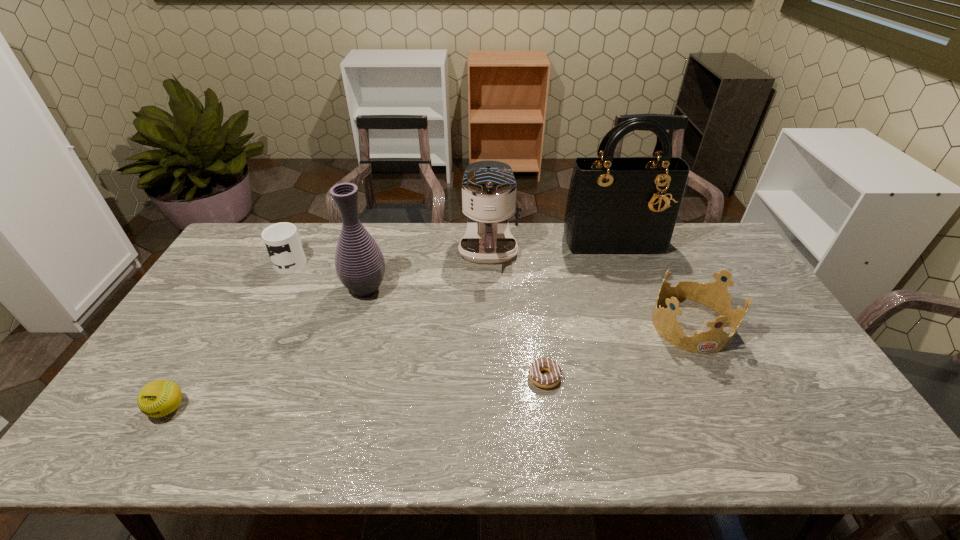
The height and width of the screenshot is (540, 960). I want to click on blank space at the near right corner of the desktop, so click(827, 443).

Image resolution: width=960 pixels, height=540 pixels. What are the coordinates of `blank region between the softball and the handbag` in the screenshot? It's located at pyautogui.click(x=391, y=325).

The width and height of the screenshot is (960, 540). Find the location of `vacant area that lies between the mug and the shortest object`. vacant area that lies between the mug and the shortest object is located at coordinates (419, 319).

You are a GUI agent. You are given a task and a screenshot of the screen. Output one action in this format:
    pyautogui.click(x=<x>, y=<y>)
    Task: Click on the vacant area that lies between the second shortest object and the handbag
    This screenshot has height=540, width=960.
    Given the screenshot: What is the action you would take?
    pyautogui.click(x=391, y=325)

You are a GUI agent. You are given a task and a screenshot of the screen. Output one action in this format:
    pyautogui.click(x=<x>, y=<y>)
    Task: Click on the vacant region between the third object from left to right and the coffee maker
    The image size is (960, 540).
    Given the screenshot: What is the action you would take?
    pyautogui.click(x=427, y=271)

Identify the location of unoccupied area between the third tallest object and the tallest object. The image size is (960, 540). (551, 247).

Locate an element on the screen. Image resolution: width=960 pixels, height=540 pixels. vacant space that is in between the fifth shortest object and the second object from left to right is located at coordinates (391, 256).

Locate an element on the screen. The width and height of the screenshot is (960, 540). free space that is in between the second object from left to right and the third tallest object is located at coordinates (391, 256).

At what (x,y) coordinates should I click in order to perform the action: click on vacant space that is in between the fifth shortest object and the mug. Please return your answer as a coordinate pair (x, y). This screenshot has width=960, height=540. Looking at the image, I should click on (391, 256).

Locate an element on the screen. This screenshot has width=960, height=540. empty space that is in between the vase and the handbag is located at coordinates (490, 265).